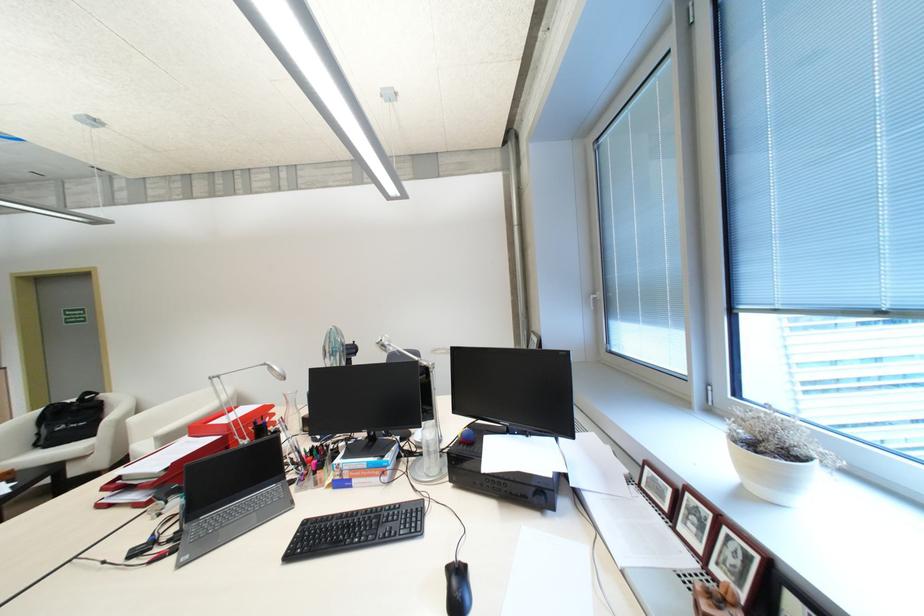
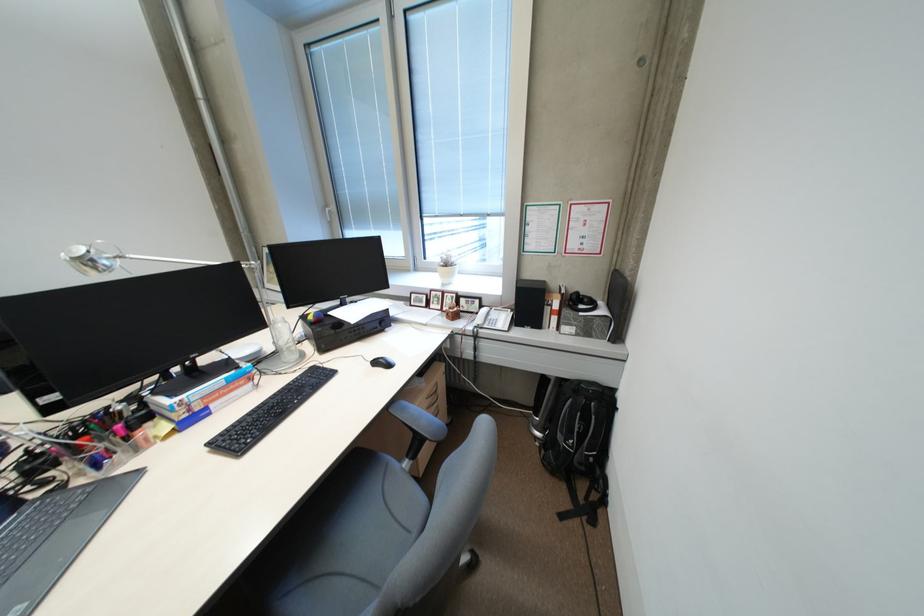
Find the pixel in the second image that matches point 650,485 in the first image.

(420, 305)